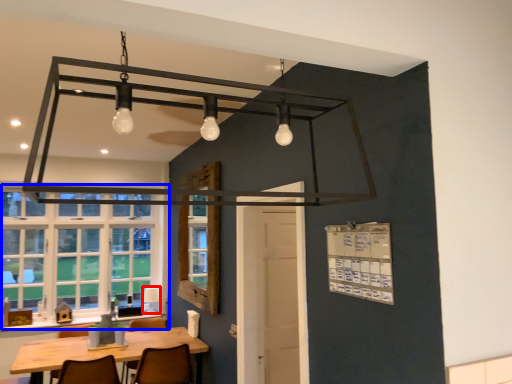
Question: Which point is closer to the camera, lamp (highlighted by a red box) or window (highlighted by a blue box)?

Choices:
 (A) lamp
 (B) window

Answer: (B)